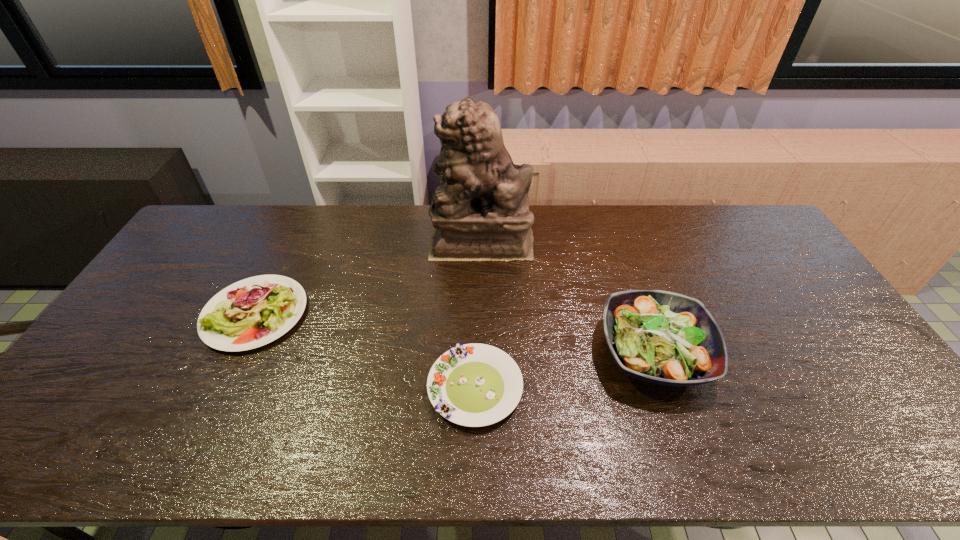
Identify the location of free area in between the farthest object and the rightmost salad plate. (567, 296).

Image resolution: width=960 pixels, height=540 pixels. I want to click on unoccupied area between the third tallest object and the rightmost object, so click(x=455, y=334).

This screenshot has height=540, width=960. I want to click on vacant area between the shortest object and the rightmost object, so click(564, 370).

At what (x,y) coordinates should I click in order to perform the action: click on free spot between the third tallest object and the sculpture. Please return your answer as a coordinate pair (x, y). The height and width of the screenshot is (540, 960). Looking at the image, I should click on (369, 277).

Find the location of a particular element. vacant space that is in between the sculpture and the second tallest object is located at coordinates (567, 296).

Where is `vacant point located between the second salad plate from left to right and the farthest object`? vacant point located between the second salad plate from left to right and the farthest object is located at coordinates [478, 314].

This screenshot has height=540, width=960. What are the coordinates of `free point between the shortest salad plate and the third tallest object` in the screenshot? It's located at (365, 351).

This screenshot has width=960, height=540. I want to click on free space between the second salad plate from right to left and the tallest salad plate, so click(564, 370).

Identify the location of empty location between the shortest object and the rightmost salad plate. (564, 370).

Find the location of `free spot between the second salad plate from right to left and the rightmost object`. free spot between the second salad plate from right to left and the rightmost object is located at coordinates (564, 370).